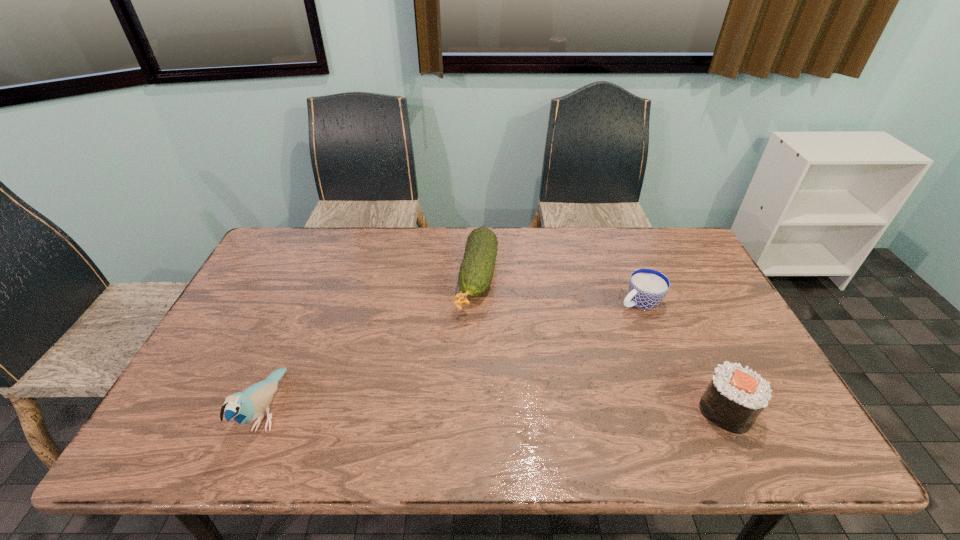
Identify the location of free spot on the desktop that is between the bird and the sushi and is positioned at the blossom end of the second object from left to right. This screenshot has width=960, height=540. (442, 411).

Where is `free space on the desktop that is between the bird and the sushi and is positioned on the side of the shortest object with the handle`? This screenshot has height=540, width=960. free space on the desktop that is between the bird and the sushi and is positioned on the side of the shortest object with the handle is located at coordinates (434, 411).